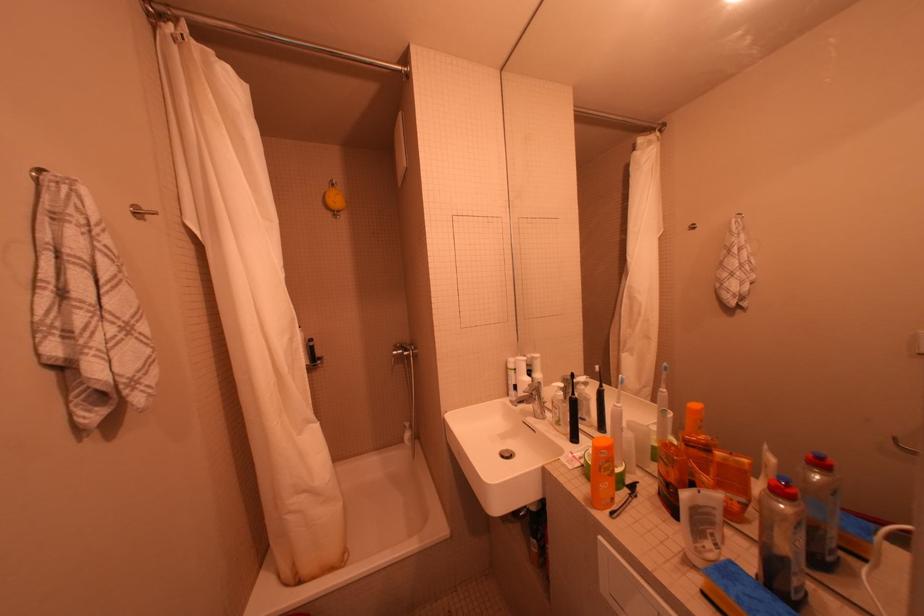
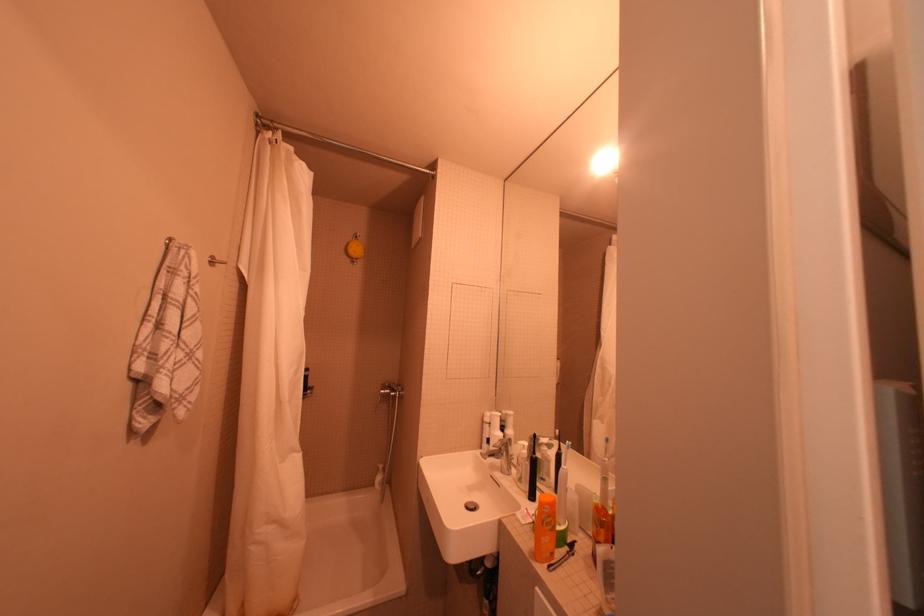
Locate, in the second image, the point that corresponds to (338,215) in the first image.

(358, 261)